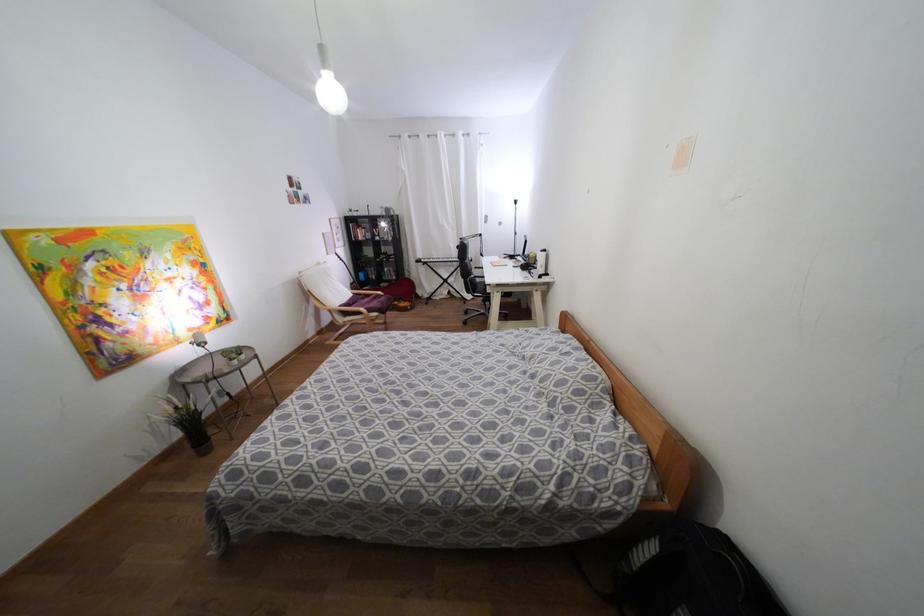
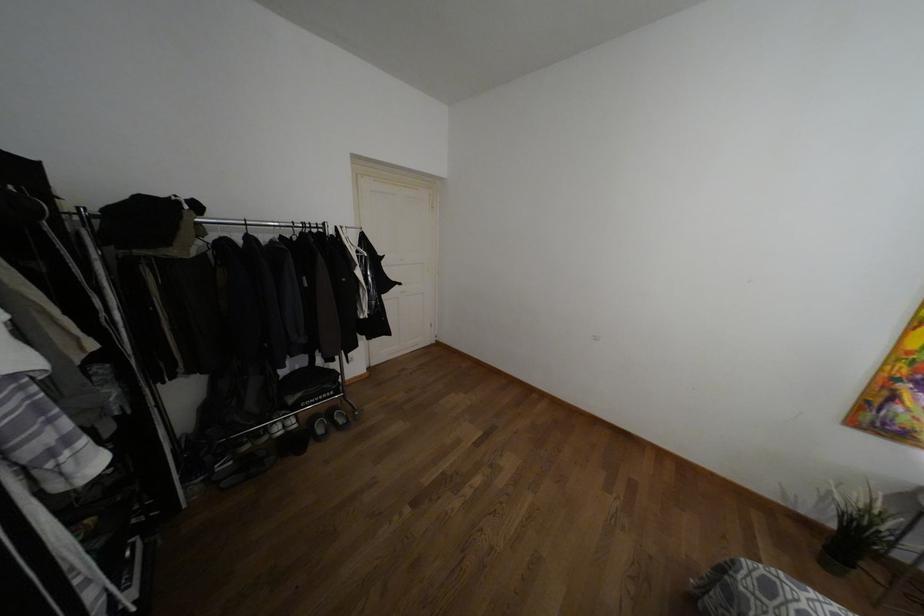
Locate, in the second image, the point that corresponds to the point at 235,474 in the first image.

(769, 588)